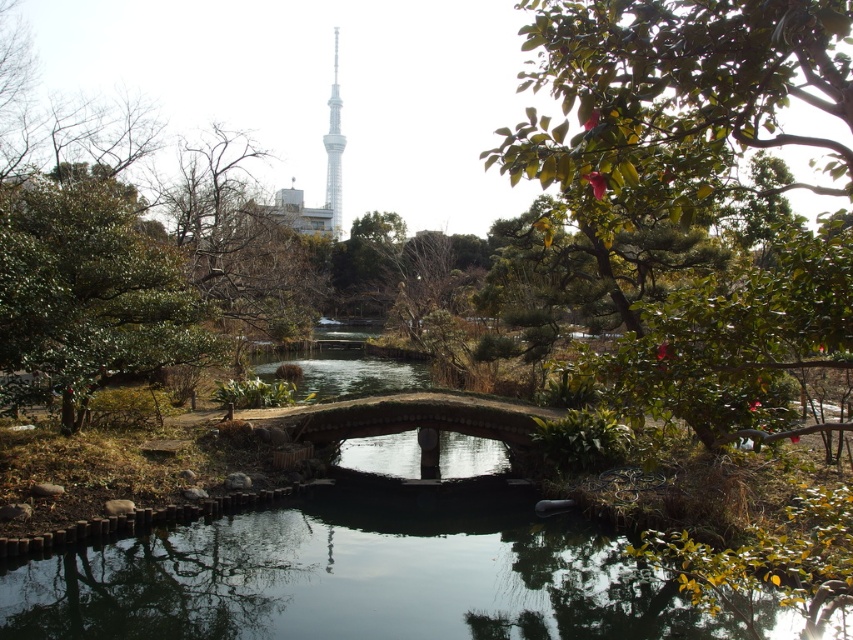
You are a photographer standing in the park and want to take a photo of the white glassy eiffel tower at upper center without the green leafy tree at center blocking it. What should you do?

Move to a position where the green leafy tree at center is no longer in front of the white glassy eiffel tower at upper center, such as moving to the side or further back to get a clear view.

Looking at this image, you are a photographer planning to take a picture of the green leafy tree at left and the white glassy eiffel tower at upper center in the park. Which object will appear bigger in your photo?

The green leafy tree at left will appear bigger in the photo because it has a larger size compared to the white glassy eiffel tower at upper center.